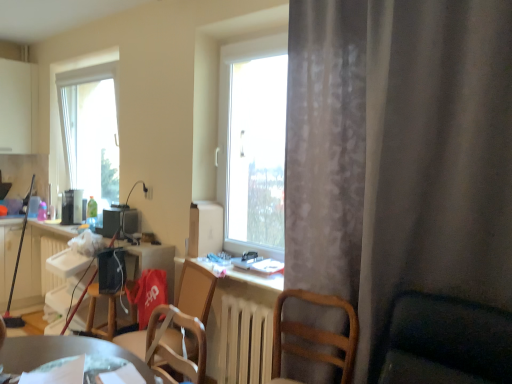
Identify the location of matte black speaker at center, placed as the second appliance when sorted from back to front. (120, 222).

The image size is (512, 384). Describe the element at coordinates (82, 80) in the screenshot. I see `transparent glass window at left` at that location.

You are a GUI agent. You are given a task and a screenshot of the screen. Output one action in this format:
    pyautogui.click(x=<x>, y=<y>)
    Task: Click on the wooden chair at center, arranged as the 3th chair when viewed from the right
    The height and width of the screenshot is (384, 512).
    Given the screenshot: What is the action you would take?
    pyautogui.click(x=196, y=291)

Find the location of a particular element. green glass bottle at center is located at coordinates (92, 208).

What is the approximate width of matte black computer desk at left?

The width of matte black computer desk at left is 23.88 inches.

The height and width of the screenshot is (384, 512). Describe the element at coordinates (150, 261) in the screenshot. I see `matte black computer desk at left` at that location.

The height and width of the screenshot is (384, 512). Describe the element at coordinates (45, 262) in the screenshot. I see `white plastic radiator at left, the first radiator when ordered from back to front` at that location.

This screenshot has width=512, height=384. I want to click on matte black speaker at center, which appears as the second appliance when viewed from the right, so click(120, 222).

Find the location of `the 2nd appliance located above the white matte radiator at center, the 1th radiator positioned from the front (from a real-world perspective)`. the 2nd appliance located above the white matte radiator at center, the 1th radiator positioned from the front (from a real-world perspective) is located at coordinates (72, 207).

In the scene shown: Would you say white matte radiator at center, the 1th radiator viewed from the right, is inside or outside matte black coffee maker at left, arranged as the 1th appliance when viewed from the left?

white matte radiator at center, the 1th radiator viewed from the right, is spatially situated outside matte black coffee maker at left, arranged as the 1th appliance when viewed from the left.

From the image's perspective, who appears lower, white matte radiator at center, which is the second radiator from back to front, or matte black coffee maker at left, the third appliance viewed from the front?

white matte radiator at center, which is the second radiator from back to front, is shown below in the image.

From the image's perspective, starting from the transparent glass window at left, which chair is the 1st one below? Please provide its 2D coordinates.

[(172, 349)]

Is transparent glass window at left thinner than wooden chair at lower center, the second chair viewed from the right?

No, transparent glass window at left is not thinner than wooden chair at lower center, the second chair viewed from the right.

Does transparent glass window at left appear on the right side of wooden chair at lower center, the second chair viewed from the right?

No.

Starting from the wooden chair at center, which appears as the 1th chair when viewed from the right, which chair is the 2nd one to the left? Please provide its 2D coordinates.

[(196, 291)]

Does wooden chair at center, arranged as the 3th chair when viewed from the right, contain wooden chair at center, which appears as the 1th chair when viewed from the right?

Definitely not — wooden chair at center, which appears as the 1th chair when viewed from the right, is not inside wooden chair at center, arranged as the 3th chair when viewed from the right.

Looking at this image, from a real-world perspective, is wooden chair at center, arranged as the 3th chair when viewed from the right, over wooden chair at center, which appears as the 1th chair when viewed from the right?

Actually, wooden chair at center, arranged as the 3th chair when viewed from the right, is physically below wooden chair at center, which appears as the 1th chair when viewed from the right, in the real world.

Is wooden chair at center, which is the third chair from left to right, in front of or behind wooden chair at center, arranged as the 3th chair when viewed from the right, in the image?

wooden chair at center, which is the third chair from left to right, is positioned closer to the viewer than wooden chair at center, arranged as the 3th chair when viewed from the right.

Considering the sizes of wooden chair at center, which appears as the 1th chair when viewed from the right, and wooden chair at center, the 1th chair positioned from the left, in the image, is wooden chair at center, which appears as the 1th chair when viewed from the right, taller or shorter than wooden chair at center, the 1th chair positioned from the left,?

Considering their sizes, wooden chair at center, which appears as the 1th chair when viewed from the right, has less height than wooden chair at center, the 1th chair positioned from the left.

From a real-world perspective, which object rests below the other?

wooden chair at center, arranged as the 3th chair when viewed from the right.

Considering the positions of objects matte black speaker at center, the 2th appliance in the left-to-right sequence, and white matte radiator at center, positioned as the 2th radiator in left-to-right order, in the image provided, who is in front, matte black speaker at center, the 2th appliance in the left-to-right sequence, or white matte radiator at center, positioned as the 2th radiator in left-to-right order,?

Positioned in front is white matte radiator at center, positioned as the 2th radiator in left-to-right order.

Measure the distance from matte black speaker at center, the 2th appliance in the left-to-right sequence, to white matte radiator at center, the 1th radiator viewed from the right.

matte black speaker at center, the 2th appliance in the left-to-right sequence, and white matte radiator at center, the 1th radiator viewed from the right, are 4.22 feet apart from each other.

Is matte black speaker at center, the second appliance when ordered from front to back, at the left side of white matte radiator at center, the 1th radiator viewed from the right?

Correct, you'll find matte black speaker at center, the second appliance when ordered from front to back, to the left of white matte radiator at center, the 1th radiator viewed from the right.

Considering the sizes of objects matte black speaker at center, placed as the second appliance when sorted from back to front, and white matte radiator at center, the 1th radiator positioned from the front, in the image provided, who is bigger, matte black speaker at center, placed as the second appliance when sorted from back to front, or white matte radiator at center, the 1th radiator positioned from the front,?

white matte radiator at center, the 1th radiator positioned from the front.

Does matte black speaker at center, placed as the second appliance when sorted from back to front, turn towards white cardboard box at center, positioned as the 1th appliance in right-to-left order?

No, matte black speaker at center, placed as the second appliance when sorted from back to front, is not aimed at white cardboard box at center, positioned as the 1th appliance in right-to-left order.

Is point (138, 224) closer or farther from the camera than point (203, 253)?

Point (138, 224) is positioned farther from the camera compared to point (203, 253).

Is matte black speaker at center, placed as the second appliance when sorted from back to front, far from white cardboard box at center, placed as the 3th appliance when sorted from back to front?

matte black speaker at center, placed as the second appliance when sorted from back to front, is near white cardboard box at center, placed as the 3th appliance when sorted from back to front, not far away.

Between matte black speaker at center, placed as the second appliance when sorted from back to front, and white cardboard box at center, placed as the 3th appliance when sorted from back to front, which one has smaller width?

matte black speaker at center, placed as the second appliance when sorted from back to front, is thinner.

From a real-world perspective, between matte black coffee maker at left, which appears as the third appliance when viewed from the right, and matte black computer desk at left, who is vertically lower?

In real-world perspective, matte black computer desk at left is lower.

From the image's perspective, is matte black coffee maker at left, the third appliance viewed from the front, beneath matte black computer desk at left?

No, from the image's perspective, matte black coffee maker at left, the third appliance viewed from the front, is not beneath matte black computer desk at left.

Is matte black coffee maker at left, the third appliance viewed from the front, closer to camera compared to matte black computer desk at left?

No, matte black coffee maker at left, the third appliance viewed from the front, is further to the viewer.

Find the location of a particular element. This screenshot has width=512, height=384. computer desk on the right of matte black coffee maker at left, the 1th appliance when ordered from back to front is located at coordinates (150, 261).

You are a GUI agent. You are given a task and a screenshot of the screen. Output one action in this format:
    pyautogui.click(x=<x>, y=<y>)
    Task: Click on the 3rd appliance above when counting from the white matte radiator at center, positioned as the 2th radiator in left-to-right order (from the image's perspective)
    The height and width of the screenshot is (384, 512).
    Given the screenshot: What is the action you would take?
    pyautogui.click(x=72, y=207)

Locate an element on the screen. The height and width of the screenshot is (384, 512). chair that is the 2nd object to the right of the transparent glass window at left, starting at the anchor is located at coordinates (172, 349).

When comparing their distances from white cardboard box at center, positioned as the 1th appliance in right-to-left order, does white plastic radiator at left, which is the 2th radiator in front-to-back order, or transparent glass window at left seem further?

transparent glass window at left.

From the image, which object appears to be farther from transparent glass window at left, wooden chair at lower center, the second chair viewed from the right, or metallic silver desk at lower center?

The object further to transparent glass window at left is metallic silver desk at lower center.

Based on their spatial positions, is white plastic radiator at left, which is counted as the first radiator, starting from the left, or wooden chair at center, the 1th chair positioned from the left, closer to green glass bottle at center?

Among the two, white plastic radiator at left, which is counted as the first radiator, starting from the left, is located nearer to green glass bottle at center.

When comparing their distances from gray sheer curtain at right, does matte black computer desk at left or white plastic radiator at left, placed as the 2th radiator when sorted from right to left, seem further?

white plastic radiator at left, placed as the 2th radiator when sorted from right to left.

Consider the image. When comparing their distances from matte black computer desk at left, does metallic silver desk at lower center or green glass bottle at center seem closer?

The object closer to matte black computer desk at left is green glass bottle at center.

Consider the image. From the image, which object appears to be farther from white cardboard box at center, placed as the 3th appliance when sorted from back to front, green glass bottle at center or matte black computer desk at left?

green glass bottle at center is positioned further to the anchor white cardboard box at center, placed as the 3th appliance when sorted from back to front.

From the image, which object appears to be nearer to wooden chair at lower center, the second chair viewed from the right, green glass bottle at center or gray sheer curtain at right?

gray sheer curtain at right.

Estimate the real-world distances between objects in this image. Which object is further from wooden chair at center, arranged as the 3th chair when viewed from the right, gray sheer curtain at right or matte black computer desk at left?

Based on the image, gray sheer curtain at right appears to be further to wooden chair at center, arranged as the 3th chair when viewed from the right.

You are a GUI agent. You are given a task and a screenshot of the screen. Output one action in this format:
    pyautogui.click(x=<x>, y=<y>)
    Task: Click on the bottle between matte black computer desk at left and white plastic radiator at left, placed as the 2th radiator when sorted from right to left, in the front-back direction
    
    Given the screenshot: What is the action you would take?
    pyautogui.click(x=92, y=208)

You are a GUI agent. You are given a task and a screenshot of the screen. Output one action in this format:
    pyautogui.click(x=<x>, y=<y>)
    Task: Click on the curtain between metallic silver desk at lower center and matte black coffee maker at left, arranged as the 1th appliance when viewed from the left, along the z-axis
    The height and width of the screenshot is (384, 512).
    Given the screenshot: What is the action you would take?
    pyautogui.click(x=399, y=155)

You are a GUI agent. You are given a task and a screenshot of the screen. Output one action in this format:
    pyautogui.click(x=<x>, y=<y>)
    Task: Click on the computer desk between wooden chair at center, which appears as the 1th chair when viewed from the right, and transparent glass window at left from front to back
    The width and height of the screenshot is (512, 384).
    Given the screenshot: What is the action you would take?
    pyautogui.click(x=150, y=261)

I want to click on appliance between matte black coffee maker at left, the third appliance viewed from the front, and white cardboard box at center, placed as the 3th appliance when sorted from back to front, from left to right, so click(120, 222).